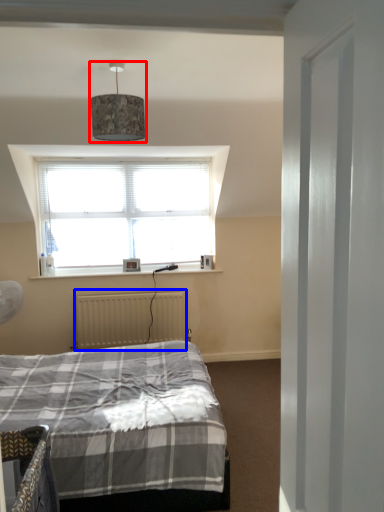
Question: Among these objects, which one is farthest to the camera, lamp (highlighted by a red box) or radiator (highlighted by a blue box)?

Choices:
 (A) lamp
 (B) radiator

Answer: (B)